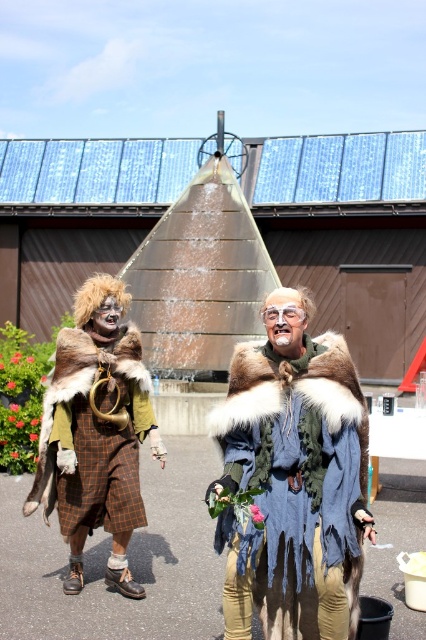
Question: Is fur-coated robe at center above fur coat at left?

Choices:
 (A) yes
 (B) no

Answer: (B)

Question: Does fur-coated robe at center have a lesser width compared to fur coat at left?

Choices:
 (A) yes
 (B) no

Answer: (A)

Question: Is fur-coated robe at center bigger than fur coat at left?

Choices:
 (A) no
 (B) yes

Answer: (B)

Question: Which point appears closest to the camera in this image?

Choices:
 (A) (29, 493)
 (B) (296, 458)

Answer: (B)

Question: Which point is closer to the camera?

Choices:
 (A) fur-coated robe at center
 (B) fur coat at left

Answer: (A)